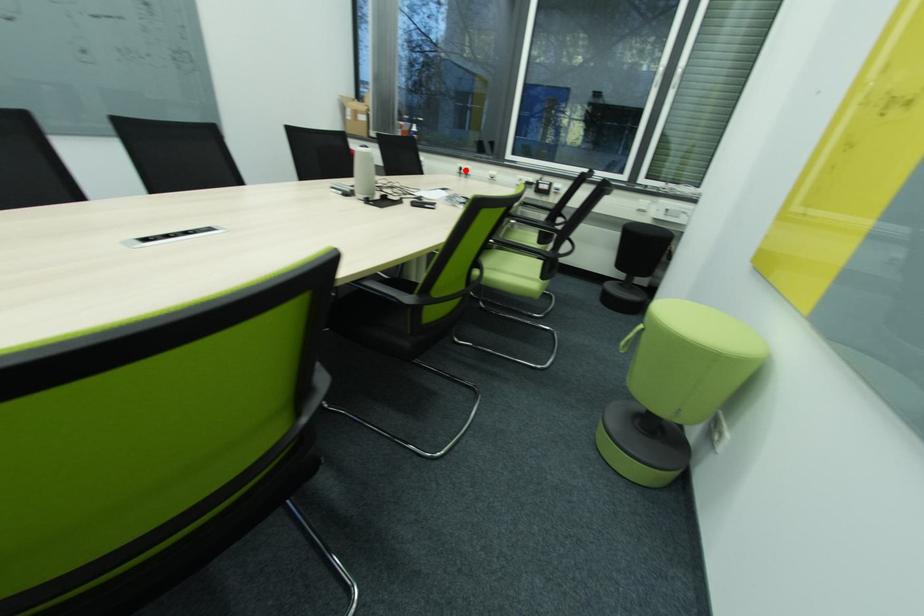
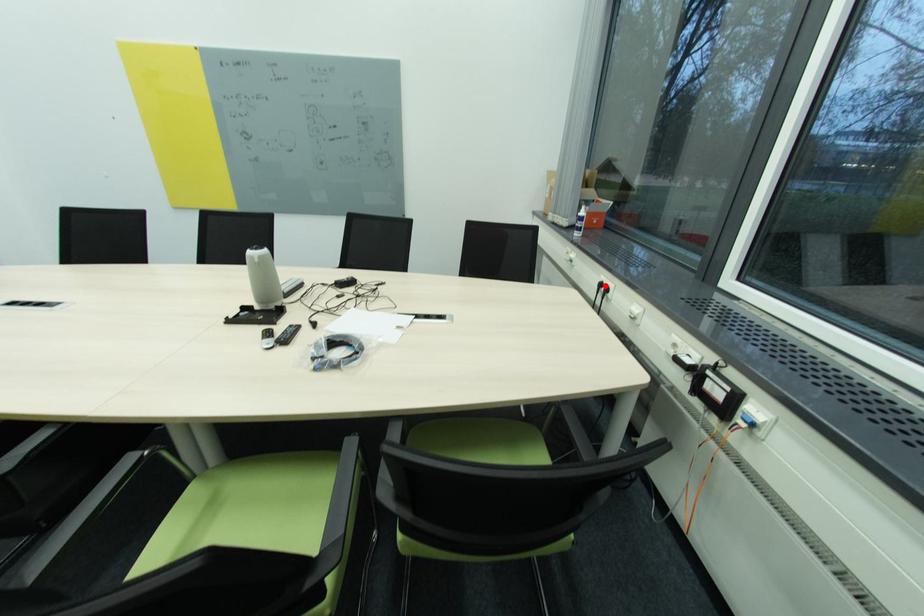
I am providing you with two images of the same scene from different viewpoints. A red point is marked on the first image and another point is marked on the second image. Is the marked point in image1 the same physical position as the marked point in image2?

Yes